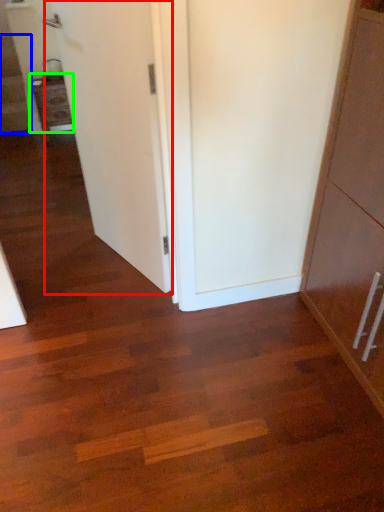
Question: Based on their relative distances, which object is nearer to door (highlighted by a red box)? Choose from stairwell (highlighted by a blue box) and cabinetry (highlighted by a green box).

Choices:
 (A) stairwell
 (B) cabinetry

Answer: (B)